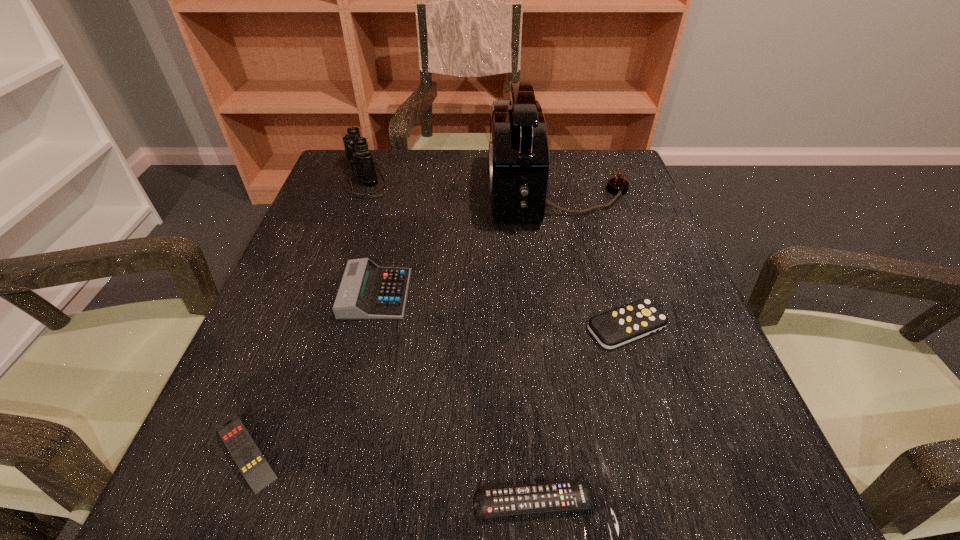
The image size is (960, 540). Find the location of `radio receiver at the right edge`. radio receiver at the right edge is located at coordinates (519, 157).

At what (x,y) coordinates should I click in order to perform the action: click on remote control that is at the right edge. Please return your answer as a coordinate pair (x, y). This screenshot has height=540, width=960. Looking at the image, I should click on (611, 329).

Locate an element on the screen. This screenshot has height=540, width=960. object at the far left corner is located at coordinates (356, 147).

The height and width of the screenshot is (540, 960). Find the location of `object at the near left corner`. object at the near left corner is located at coordinates (246, 454).

The image size is (960, 540). What are the coordinates of `object located at the far right corner` in the screenshot? It's located at (519, 157).

The height and width of the screenshot is (540, 960). Identify the location of vacant point at the far edge. (553, 158).

At what (x,y) coordinates should I click in order to perform the action: click on vacant area at the near edge. Please return your answer as a coordinate pair (x, y). Looking at the image, I should click on (549, 473).

The image size is (960, 540). Find the location of `vacant space at the left edge of the desktop`. vacant space at the left edge of the desktop is located at coordinates (277, 363).

The image size is (960, 540). In the image, there is a desktop. What are the coordinates of `vacant space at the right edge` in the screenshot? It's located at (661, 346).

Image resolution: width=960 pixels, height=540 pixels. In the image, there is a desktop. What are the coordinates of `vacant space at the far right corner` in the screenshot? It's located at (570, 152).